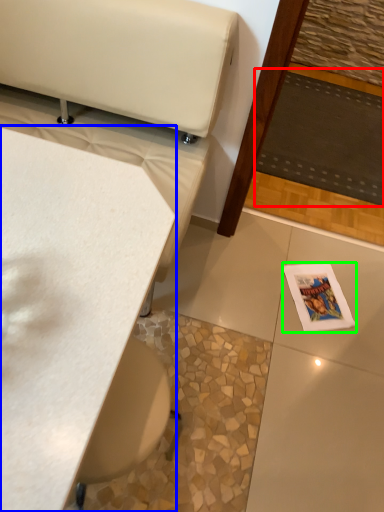
Question: Based on their relative distances, which object is farther from mat (highlighted by a red box)? Choose from table (highlighted by a blue box) and magazine (highlighted by a green box).

Choices:
 (A) table
 (B) magazine

Answer: (A)